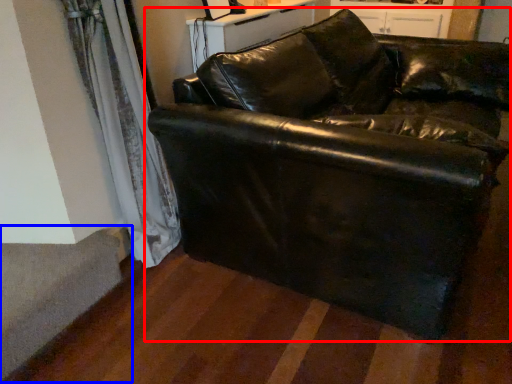
Question: Which of the following is the farthest to the observer, studio couch (highlighted by a red box) or stairwell (highlighted by a blue box)?

Choices:
 (A) studio couch
 (B) stairwell

Answer: (B)